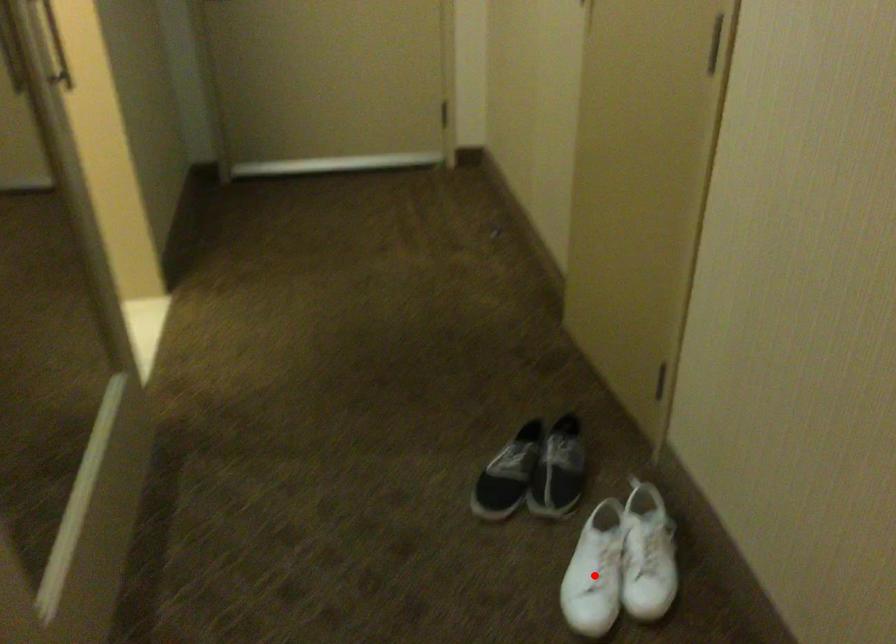
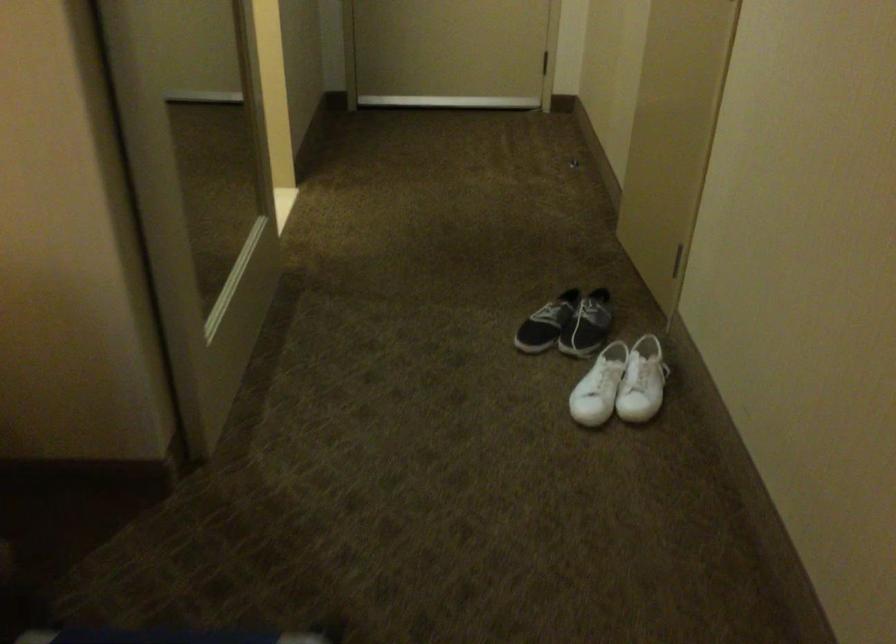
Find the pixel in the second image that matches the highlighted location in the first image.

(599, 386)